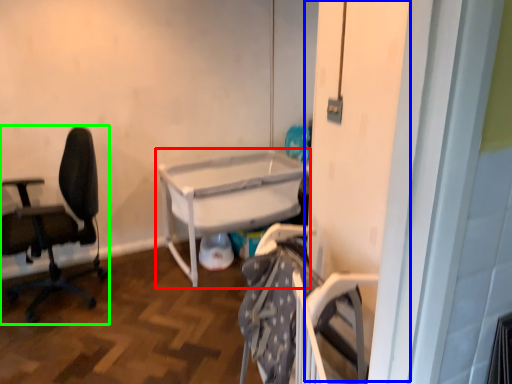
Question: Estimate the real-world distances between objects in this image. Which object is closer to table (highlighted by a red box), screen door (highlighted by a blue box) or chair (highlighted by a green box)?

Choices:
 (A) screen door
 (B) chair

Answer: (B)